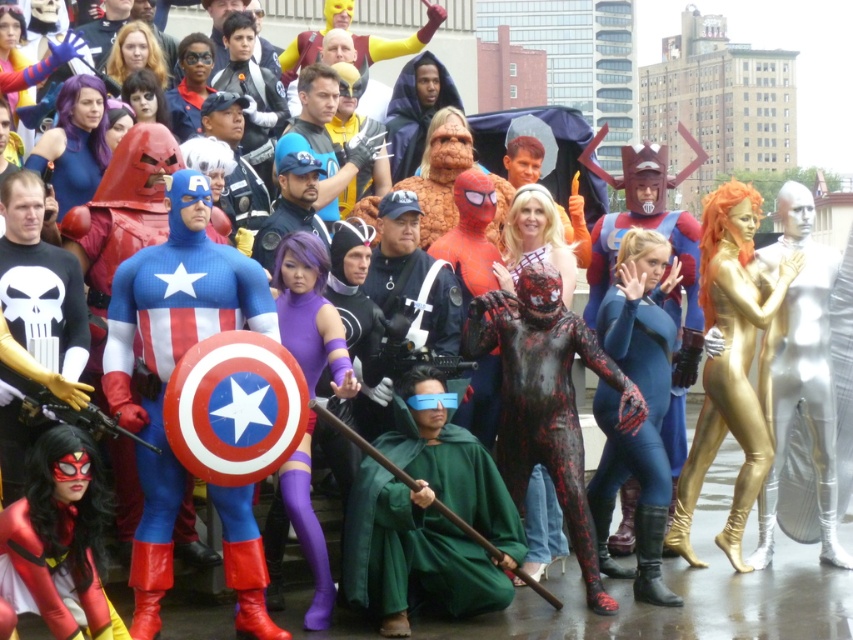
What do you see at coordinates (171, 358) in the screenshot? I see `shiny spandex suit at center` at bounding box center [171, 358].

Is shiny spandex suit at center shorter than green velvet cloak at center?

In fact, shiny spandex suit at center may be taller than green velvet cloak at center.

The image size is (853, 640). Describe the element at coordinates (171, 358) in the screenshot. I see `shiny spandex suit at center` at that location.

The height and width of the screenshot is (640, 853). Identify the location of shiny spandex suit at center. (171, 358).